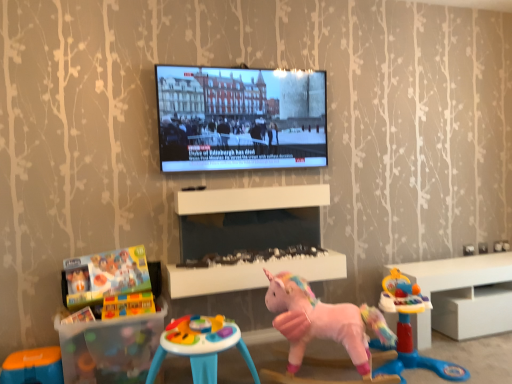
Locate an element on the screen. orange plastic stool at lower left, which is the first toy in left-to-right order is located at coordinates (33, 367).

At what (x,y) coordinates should I click in order to perform the action: click on pink plush unicorn at center, which is counted as the 5th toy, starting from the left. Please return your answer as a coordinate pair (x, y). Looking at the image, I should click on (323, 324).

Locate an element on the screen. This screenshot has width=512, height=384. multicolored plastic activity table at center, the third toy in the right-to-left sequence is located at coordinates (200, 346).

The width and height of the screenshot is (512, 384). What do you see at coordinates (128, 305) in the screenshot? I see `brick-like plastic blocks at lower left, marked as the 4th toy in a right-to-left arrangement` at bounding box center [128, 305].

What do you see at coordinates (252, 274) in the screenshot? I see `smooth plastic table at center, which is the second table from left to right` at bounding box center [252, 274].

Where is `matte black screen at upper center`? matte black screen at upper center is located at coordinates (240, 118).

From the image's perspective, is matte black screen at upper center on multicolored plastic activity table at center, the fourth toy in the left-to-right sequence?

Yes, from the image's perspective, matte black screen at upper center is on top of multicolored plastic activity table at center, the fourth toy in the left-to-right sequence.

Is point (295, 86) farther from viewer compared to point (202, 364)?

Yes, it is behind point (202, 364).

Considering the relative sizes of matte black screen at upper center and multicolored plastic activity table at center, the fourth toy in the left-to-right sequence, in the image provided, is matte black screen at upper center shorter than multicolored plastic activity table at center, the fourth toy in the left-to-right sequence,?

Incorrect, the height of matte black screen at upper center does not fall short of that of multicolored plastic activity table at center, the fourth toy in the left-to-right sequence.

From a real-world perspective, is matte black screen at upper center on top of multicolored plastic activity table at center, the third toy in the right-to-left sequence?

Correct, in the physical world, matte black screen at upper center is higher than multicolored plastic activity table at center, the third toy in the right-to-left sequence.

Considering the relative positions of brick-like plastic blocks at lower left, the 3th toy in the left-to-right sequence, and orange plastic stool at lower left, which is the first toy in left-to-right order, in the image provided, is brick-like plastic blocks at lower left, the 3th toy in the left-to-right sequence, to the right of orange plastic stool at lower left, which is the first toy in left-to-right order, from the viewer's perspective?

Yes.

Is brick-like plastic blocks at lower left, marked as the 4th toy in a right-to-left arrangement, facing away from orange plastic stool at lower left, the sixth toy when ordered from right to left?

No, orange plastic stool at lower left, the sixth toy when ordered from right to left, is not at the back of brick-like plastic blocks at lower left, marked as the 4th toy in a right-to-left arrangement.

From the image's perspective, is brick-like plastic blocks at lower left, the 3th toy in the left-to-right sequence, under orange plastic stool at lower left, which is the first toy in left-to-right order?

No.

How far apart are orange plastic stool at lower left, which is the first toy in left-to-right order, and matte black screen at upper center?

The distance of orange plastic stool at lower left, which is the first toy in left-to-right order, from matte black screen at upper center is 5.12 feet.

From a real-world perspective, which toy is the 6th one underneath the matte black screen at upper center? Please provide its 2D coordinates.

[(33, 367)]

Which point is more distant from viewer, (45, 378) or (293, 153)?

The point (293, 153) is behind.

Is matte black screen at upper center located within orange plastic stool at lower left, the sixth toy when ordered from right to left?

That's incorrect, matte black screen at upper center is not inside orange plastic stool at lower left, the sixth toy when ordered from right to left.

Is orange plastic stool at lower left, the sixth toy when ordered from right to left, facing towards brick-like plastic blocks at lower left, marked as the 4th toy in a right-to-left arrangement?

No, orange plastic stool at lower left, the sixth toy when ordered from right to left, does not turn towards brick-like plastic blocks at lower left, marked as the 4th toy in a right-to-left arrangement.

Choose the correct answer: Is orange plastic stool at lower left, which is the first toy in left-to-right order, inside brick-like plastic blocks at lower left, marked as the 4th toy in a right-to-left arrangement, or outside it?

orange plastic stool at lower left, which is the first toy in left-to-right order, lies outside brick-like plastic blocks at lower left, marked as the 4th toy in a right-to-left arrangement.

Identify the location of the 4th toy above the orange plastic stool at lower left, the sixth toy when ordered from right to left (from the image's perspective). The height and width of the screenshot is (384, 512). (128, 305).

From a real-world perspective, which object stands above the other?

brick-like plastic blocks at lower left, the 3th toy in the left-to-right sequence.

Which of these two, matte black screen at upper center or translucent plastic building blocks at lower left, which appears as the second toy when viewed from the left, is bigger?

matte black screen at upper center.

Does matte black screen at upper center contain translucent plastic building blocks at lower left, which appears as the second toy when viewed from the left?

That's incorrect, translucent plastic building blocks at lower left, which appears as the second toy when viewed from the left, is not inside matte black screen at upper center.

Which is closer to the camera, (x=253, y=123) or (x=96, y=318)?

Point (x=253, y=123) is positioned farther from the camera compared to point (x=96, y=318).

From the matte black screen at upper center, count the 3rd toy to the left and point to it. Please provide its 2D coordinates.

[(106, 277)]

Would you say translucent plastic table at lower left, the first table when ordered from left to right, is inside or outside smooth plastic table at center, which is the second table from left to right?

translucent plastic table at lower left, the first table when ordered from left to right, exists outside the volume of smooth plastic table at center, which is the second table from left to right.

Does translucent plastic table at lower left, the 1th table from the bottom, come in front of smooth plastic table at center, the first table viewed from the right?

Yes, it is in front of smooth plastic table at center, the first table viewed from the right.

Considering the relative sizes of translucent plastic table at lower left, the first table when ordered from left to right, and smooth plastic table at center, which is the second table from left to right, in the image provided, is translucent plastic table at lower left, the first table when ordered from left to right, shorter than smooth plastic table at center, which is the second table from left to right,?

No, translucent plastic table at lower left, the first table when ordered from left to right, is not shorter than smooth plastic table at center, which is the second table from left to right.

Considering the positions of point (313, 80) and point (177, 277), is point (313, 80) closer or farther from the camera than point (177, 277)?

Point (313, 80) is farther from the camera than point (177, 277).

Is matte black screen at upper center aimed at smooth plastic table at center, which is the second table from left to right?

No, matte black screen at upper center is not facing towards smooth plastic table at center, which is the second table from left to right.

Find the location of a particular element. The height and width of the screenshot is (384, 512). table that is the 1st object located in front of the matte black screen at upper center is located at coordinates [252, 274].

Does matte black screen at upper center touch smooth plastic table at center, the first table viewed from the right?

No.

The width and height of the screenshot is (512, 384). In order to click on television that is on the right side of multicolored plastic activity table at center, the third toy in the right-to-left sequence in this screenshot , I will do `click(240, 118)`.

Image resolution: width=512 pixels, height=384 pixels. I want to click on the 4th toy above the orange plastic stool at lower left, which is the first toy in left-to-right order (from the image's perspective), so click(128, 305).

When comparing their distances from pink fabric unicorn at center, which appears as the 6th toy when viewed from the left, does smooth plastic table at center, arranged as the 1th table when viewed from the top, or translucent plastic table at lower left, the second table viewed from the top, seem closer?

The object closer to pink fabric unicorn at center, which appears as the 6th toy when viewed from the left, is smooth plastic table at center, arranged as the 1th table when viewed from the top.

Considering their positions, is pink plush unicorn at center, which is counted as the 5th toy, starting from the left, positioned further to brick-like plastic blocks at lower left, marked as the 4th toy in a right-to-left arrangement, than matte black screen at upper center?

matte black screen at upper center.

When comparing their distances from brick-like plastic blocks at lower left, the 3th toy in the left-to-right sequence, does matte black screen at upper center or pink fabric unicorn at center, which appears as the 6th toy when viewed from the left, seem further?

Based on the image, pink fabric unicorn at center, which appears as the 6th toy when viewed from the left, appears to be further to brick-like plastic blocks at lower left, the 3th toy in the left-to-right sequence.

From the image, which object appears to be nearer to pink plush unicorn at center, the 2th toy positioned from the right, white glossy cabinet at right or translucent plastic table at lower left, the 1th table from the bottom?

The object closer to pink plush unicorn at center, the 2th toy positioned from the right, is white glossy cabinet at right.

When comparing their distances from translucent plastic table at lower left, the first table when ordered from left to right, does orange plastic stool at lower left, which is the first toy in left-to-right order, or pink fabric unicorn at center, which appears as the 6th toy when viewed from the left, seem closer?

orange plastic stool at lower left, which is the first toy in left-to-right order, is positioned closer to the anchor translucent plastic table at lower left, the first table when ordered from left to right.

From the image, which object appears to be farther from brick-like plastic blocks at lower left, the 3th toy in the left-to-right sequence, pink plush unicorn at center, which is counted as the 5th toy, starting from the left, or multicolored plastic activity table at center, the third toy in the right-to-left sequence?

pink plush unicorn at center, which is counted as the 5th toy, starting from the left, is positioned further to the anchor brick-like plastic blocks at lower left, the 3th toy in the left-to-right sequence.

Based on their spatial positions, is matte black screen at upper center or pink fabric unicorn at center, which appears as the 6th toy when viewed from the left, further from multicolored plastic activity table at center, the third toy in the right-to-left sequence?

matte black screen at upper center is further to multicolored plastic activity table at center, the third toy in the right-to-left sequence.

Considering their positions, is matte black screen at upper center positioned further to multicolored plastic activity table at center, the fourth toy in the left-to-right sequence, than brick-like plastic blocks at lower left, marked as the 4th toy in a right-to-left arrangement?

Answer: The object further to multicolored plastic activity table at center, the fourth toy in the left-to-right sequence, is matte black screen at upper center.

The height and width of the screenshot is (384, 512). I want to click on toy between matte black screen at upper center and brick-like plastic blocks at lower left, the 3th toy in the left-to-right sequence, from top to bottom, so coord(106,277).

The image size is (512, 384). Find the location of `toy between matte black screen at upper center and smooth plastic table at center, which is the second table from left to right, vertically`. toy between matte black screen at upper center and smooth plastic table at center, which is the second table from left to right, vertically is located at coordinates (106, 277).

At what (x,y) coordinates should I click in order to perform the action: click on table located between translucent plastic table at lower left, the second table viewed from the top, and white glossy cabinet at right in the left-right direction. Please return your answer as a coordinate pair (x, y). The height and width of the screenshot is (384, 512). Looking at the image, I should click on (252, 274).

The width and height of the screenshot is (512, 384). I want to click on table situated between translucent plastic building blocks at lower left, which is counted as the fifth toy, starting from the right, and multicolored plastic activity table at center, the third toy in the right-to-left sequence, from left to right, so click(x=110, y=348).